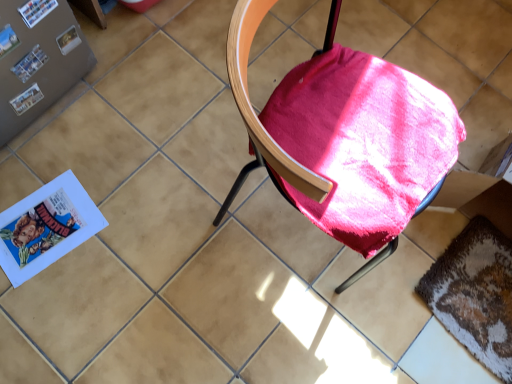
Where is `free spot in front of velvet-like pink cushion at center`? free spot in front of velvet-like pink cushion at center is located at coordinates (x=274, y=325).